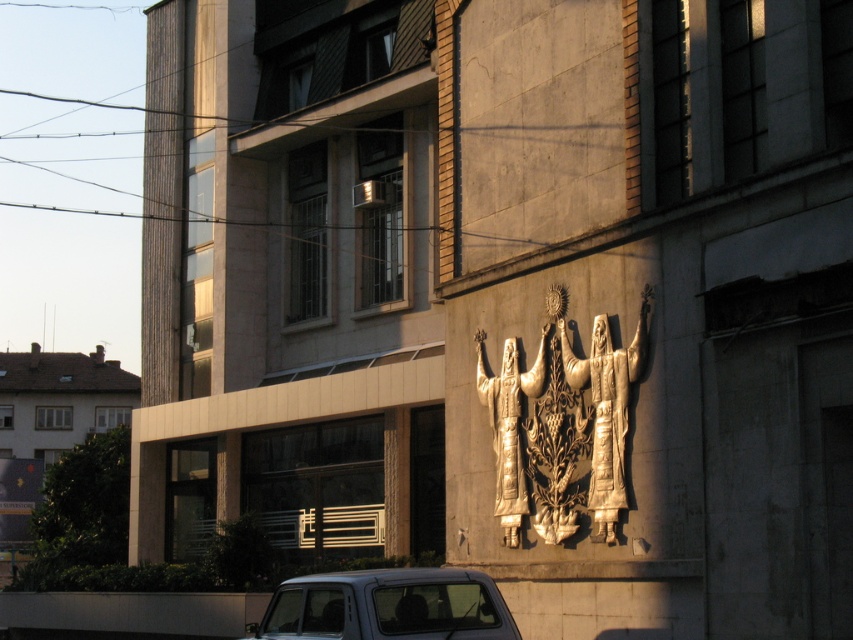
You are standing in front of the modern building described in the scene. There is a gold textured relief at center. If you want to take a photo of the relief, where should you aim your camera relative to your current position?

The gold textured relief at center is located at coordinates approximately 0.633 on the horizontal axis and 0.712 on the vertical axis, so you should aim your camera slightly to the right and upwards from your current position to capture it.

You are a photographer standing in front of the building. You want to capture both the metallic silver car at lower center and the gold textured statue at center in a single photo. Which object should you focus on first to ensure both are in frame?

The metallic silver car at lower center has a lesser height compared to the gold textured statue at center, so you should focus on the gold textured statue at center first to ensure both are in frame.